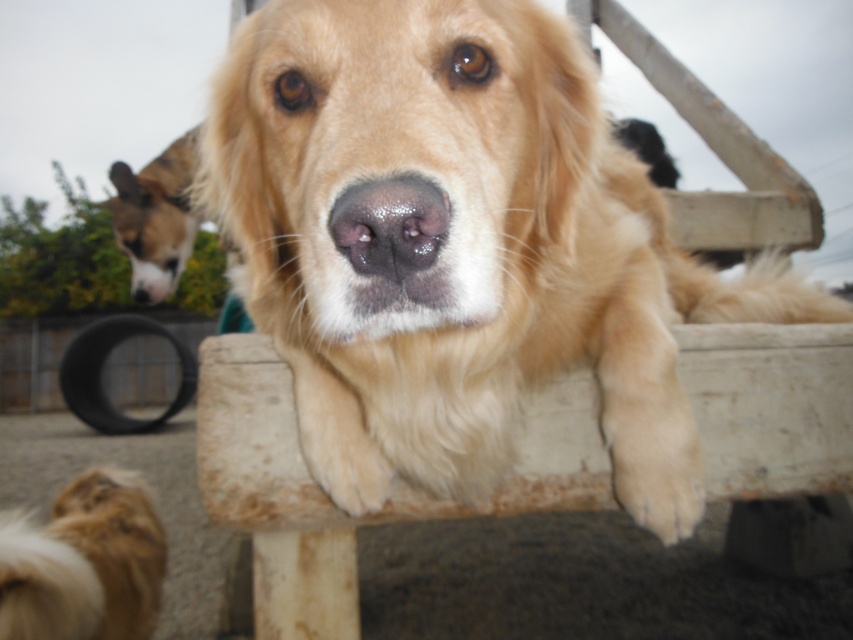
You are a photographer trying to capture the golden retriever on the bench. You notice the fuzzy brown fur at lower left and the brown fur dog at left in the image. Which object is positioned lower in the scene?

The fuzzy brown fur at lower left is located below the brown fur dog at left, so it is positioned lower in the scene.

You are a photographer trying to capture both the golden retriever at center and the brown fur dog at left in the same frame. Based on their positions, which dog is closer to the right edge of the photo?

The golden retriever at center is positioned on the right side of brown fur dog at left, so the golden retriever at center is closer to the right edge of the photo.